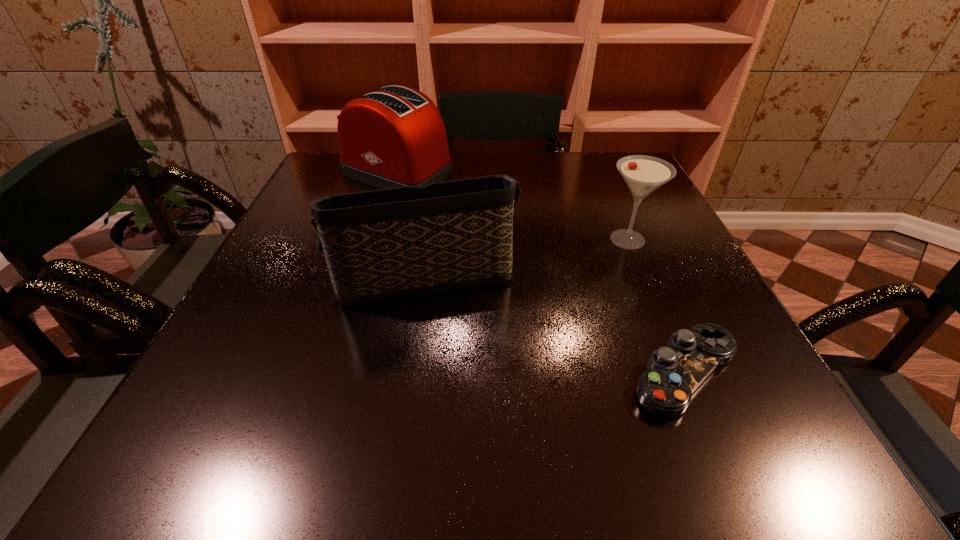
Where is `free spot between the second shortest object and the handbag`? The image size is (960, 540). free spot between the second shortest object and the handbag is located at coordinates (524, 257).

Select which object appears as the third closest to the control. Please provide its 2D coordinates. Your answer should be formatted as a tuple, i.e. [(x, y)], where the tuple contains the x and y coordinates of a point satisfying the conditions above.

[(393, 137)]

Find the location of `object that ranks as the second closest to the handbag`. object that ranks as the second closest to the handbag is located at coordinates (393, 137).

Find the location of `free point that satisfies the following two spatial constraints: 1. on the front side of the handbag; 2. on the left side of the shortest object`. free point that satisfies the following two spatial constraints: 1. on the front side of the handbag; 2. on the left side of the shortest object is located at coordinates (405, 373).

Locate an element on the screen. The height and width of the screenshot is (540, 960). vacant area that satisfies the following two spatial constraints: 1. on the back side of the second shortest object; 2. on the right side of the handbag is located at coordinates (426, 239).

I want to click on free space that satisfies the following two spatial constraints: 1. on the back side of the martini; 2. on the right side of the handbag, so click(x=426, y=239).

Find the location of `free space that satisfies the following two spatial constraints: 1. on the front side of the farthest object; 2. on the left side of the handbag`. free space that satisfies the following two spatial constraints: 1. on the front side of the farthest object; 2. on the left side of the handbag is located at coordinates (368, 275).

Where is `free point that satisfies the following two spatial constraints: 1. on the front side of the toaster; 2. on the left side of the handbag`? free point that satisfies the following two spatial constraints: 1. on the front side of the toaster; 2. on the left side of the handbag is located at coordinates point(368,275).